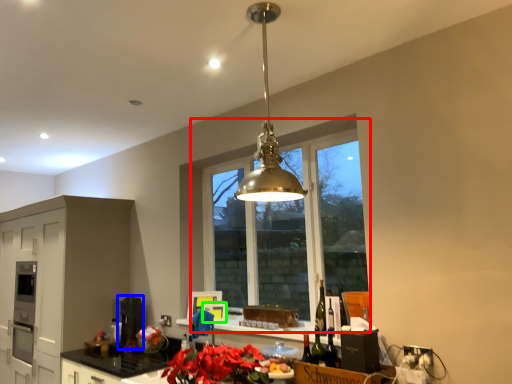
Question: Based on their relative distances, which object is farther from window (highlighted by a red box)? Choose from appliance (highlighted by a blue box) and appliance (highlighted by a green box).

Choices:
 (A) appliance
 (B) appliance

Answer: (B)